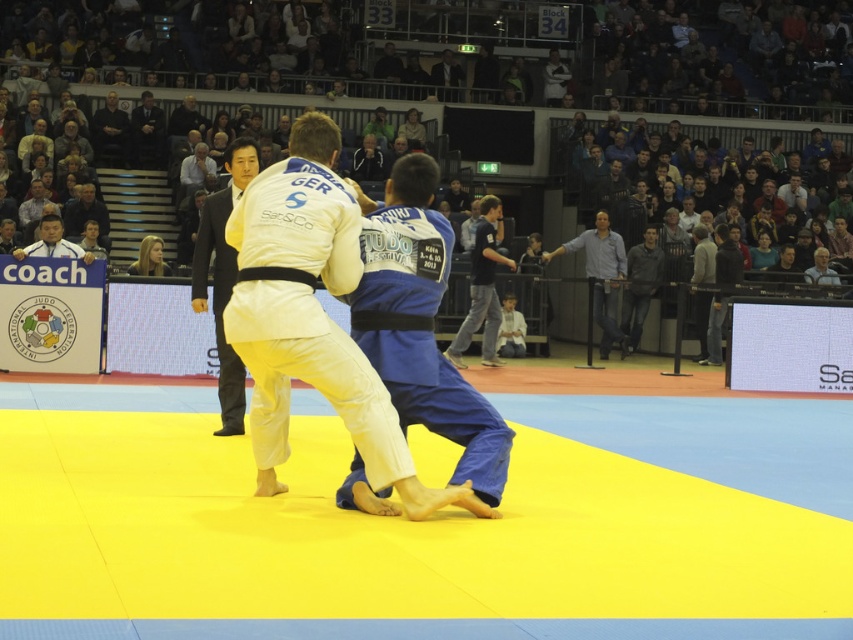
Question: Where is white fabric judo at center located in relation to gray cotton shirt at center in the image?

Choices:
 (A) below
 (B) above

Answer: (A)

Question: Which of the following is the farthest from the observer?

Choices:
 (A) light blue shirt at upper right
 (B) white cotton kimono at center
 (C) matte black shirt at upper left

Answer: (A)

Question: Among these objects, which one is nearest to the camera?

Choices:
 (A) light blue shirt at upper right
 (B) matte black shirt at upper left
 (C) dark gray suit at upper center
 (D) dark blue jeans at center

Answer: (B)

Question: Where is light blue shirt at upper right located in relation to matte black shirt at upper left in the image?

Choices:
 (A) left
 (B) right

Answer: (B)

Question: Is dark blue jeans at center smaller than matte black shirt at upper left?

Choices:
 (A) no
 (B) yes

Answer: (A)

Question: Which point is farther from the camera taking this photo?

Choices:
 (A) (611, 308)
 (B) (631, 250)

Answer: (A)